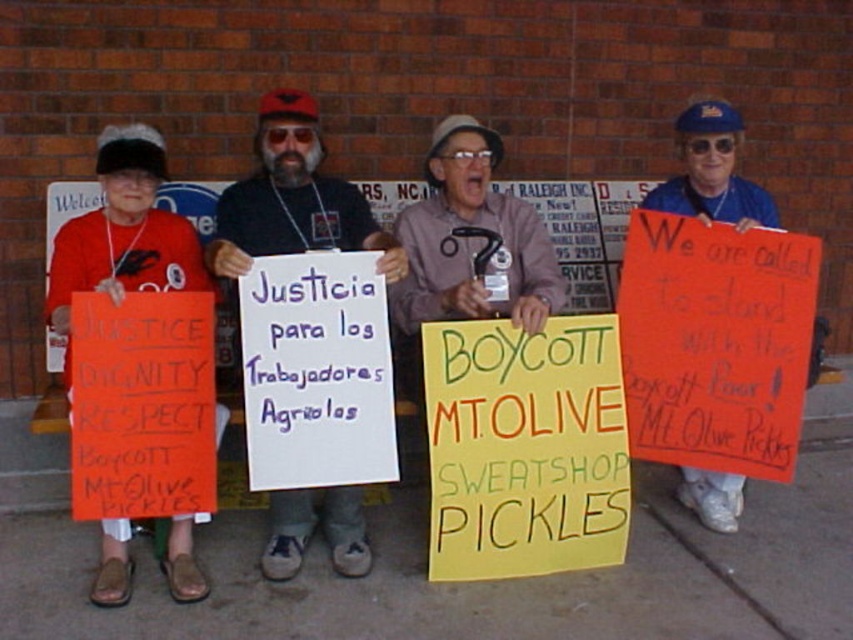
This screenshot has height=640, width=853. What do you see at coordinates (480, 582) in the screenshot? I see `concrete pavement at lower center` at bounding box center [480, 582].

From the picture: Is the position of concrete pavement at lower center more distant than that of blue fabric cap at upper right?

No, concrete pavement at lower center is in front of blue fabric cap at upper right.

Identify the location of concrete pavement at lower center. 480,582.

Who is lower down, yellow paper sign at center or black fabric shirt at center?

Positioned lower is yellow paper sign at center.

Does yellow paper sign at center have a smaller size compared to black fabric shirt at center?

Yes.

Locate an element on the screen. Image resolution: width=853 pixels, height=640 pixels. yellow paper sign at center is located at coordinates (525, 448).

Based on the photo, is concrete pavement at lower center further to the viewer compared to black fabric shirt at center?

No.

Between point (485, 625) and point (305, 228), which one is positioned in front?

Point (485, 625) is more forward.

Describe the element at coordinates (480, 582) in the screenshot. I see `concrete pavement at lower center` at that location.

The width and height of the screenshot is (853, 640). Identify the location of concrete pavement at lower center. pos(480,582).